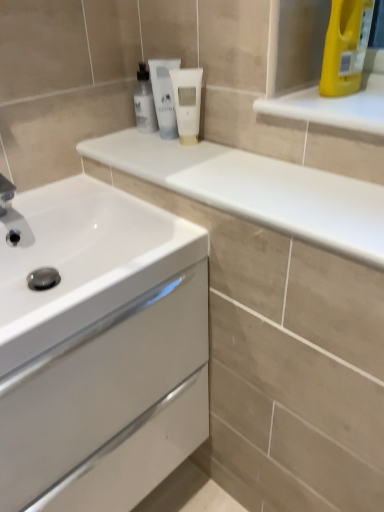
I want to click on vacant region in front of white glossy mouthwash at upper center, the 3th mouthwash from the right, so click(146, 150).